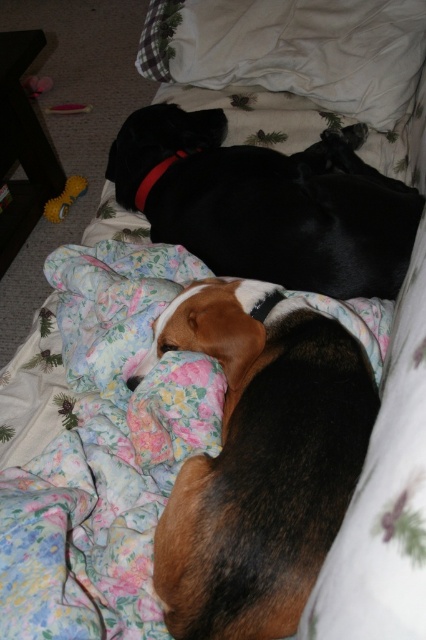
You are standing in front of the bed and see two points marked on the quilt. Which point is closer to you, point (221, 540) or point (172, 160)?

Answer: Point (221, 540) is closer to the viewer than point (172, 160).

You are standing in front of the bed and want to reach the point at coordinates point (348, 193). If your arm can reach 1.2 meters, can you touch it?

The point (348, 193) is 1.15 meters from the camera, so yes, you can touch it since your arm can reach 1.2 meters.

You are a pet owner who wants to place a small toy between the brown and black fur at center and the rubber neckband at center. Which object should you place the toy closer to so that the toy is not hidden by the taller object?

The brown and black fur at center is taller than the rubber neckband at center. To prevent the toy from being hidden, place it closer to the rubber neckband at center.